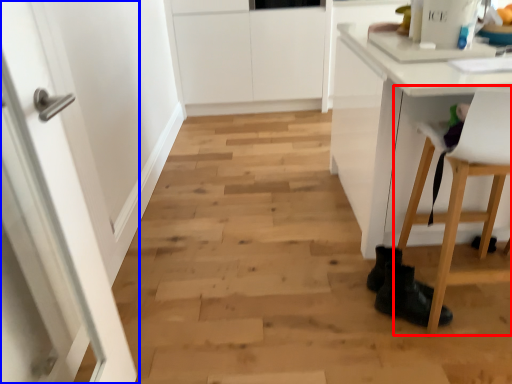
Question: Which of the following is the closest to the observer, chair (highlighted by a red box) or door (highlighted by a blue box)?

Choices:
 (A) chair
 (B) door

Answer: (B)